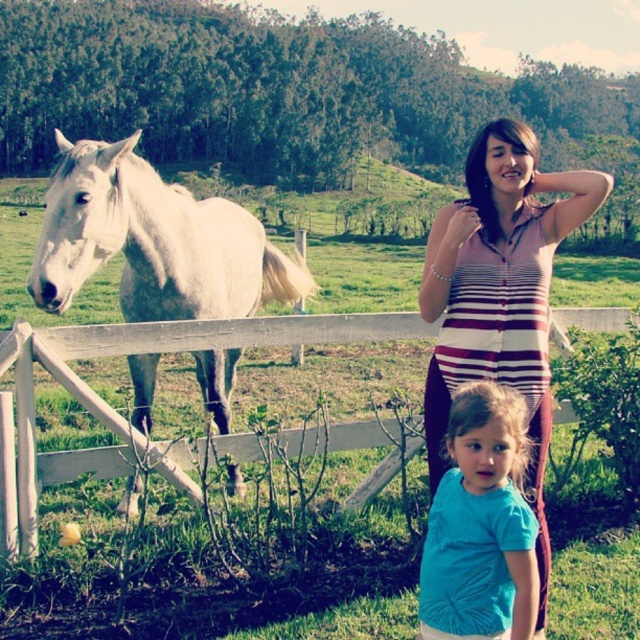
You are standing at the origin point of the coordinate system in the image. You see two points marked as point (552, 209) and point (22, 488). Which point is closer to you?

Point (552, 209) is in front of point (22, 488), so it is closer to you.

You are standing in a rural field with two points marked in the scene. The first point is at coordinates point (38, 244) and the second is at point (456, 468). If you want to reach the point that is closer to you, which coordinate should you head towards?

You should head towards point (38, 244) because it is closer to you than point (456, 468).

You are a photographer trying to capture a photo of the white matte horse at left and the striped knit sweater at center. Since you want both subjects to appear balanced in size in the final image, which subject should you move closer to the camera?

The striped knit sweater at center should be moved closer to the camera because the white matte horse at left is larger in size than the striped knit sweater at center. By moving the smaller sweater closer, it will appear larger in the photo, balancing its size with the horse.